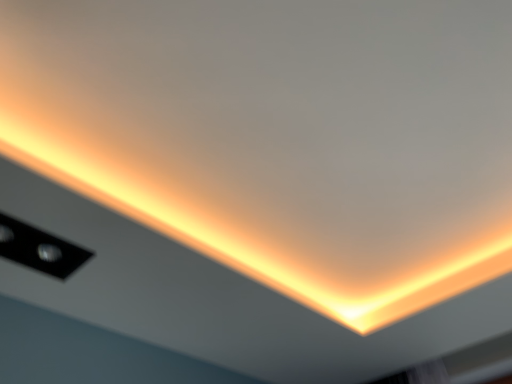
Identify the location of matte black button at lower left. Image resolution: width=512 pixels, height=384 pixels. (39, 249).

This screenshot has width=512, height=384. What do you see at coordinates (39, 249) in the screenshot? I see `matte black button at lower left` at bounding box center [39, 249].

Identify the location of matte black button at lower left. (39, 249).